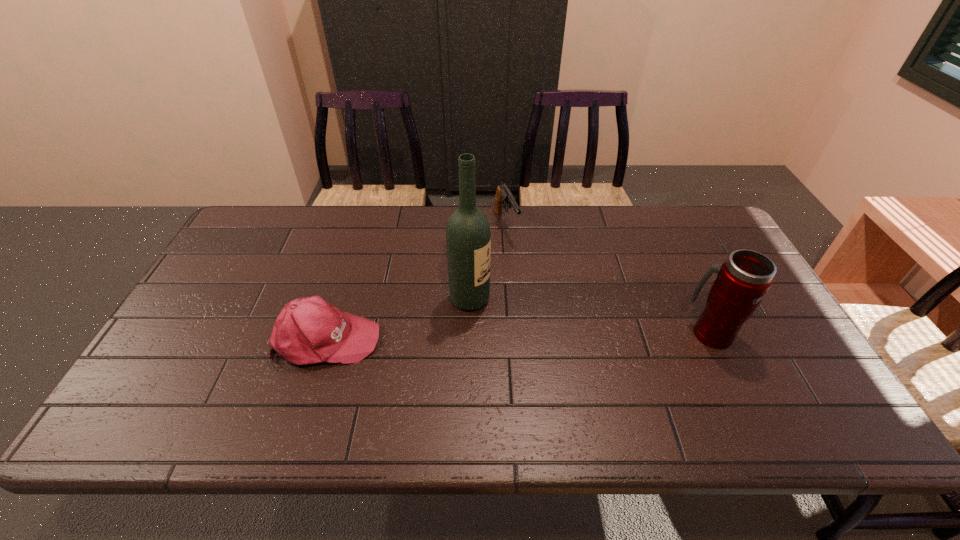
I want to click on free space that satisfies the following two spatial constraints: 1. on the front side of the tallest object; 2. on the side with the handle of the third shortest object, so click(469, 333).